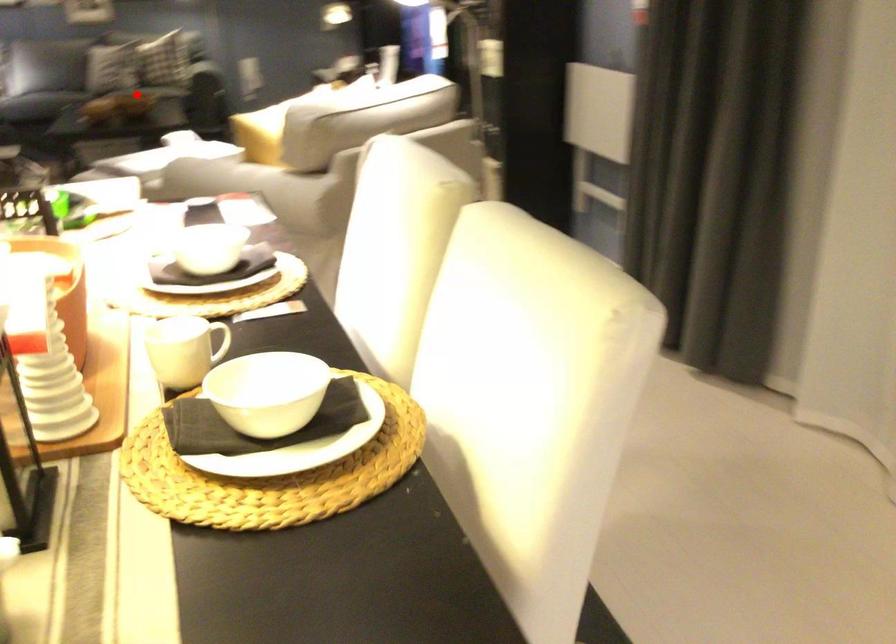
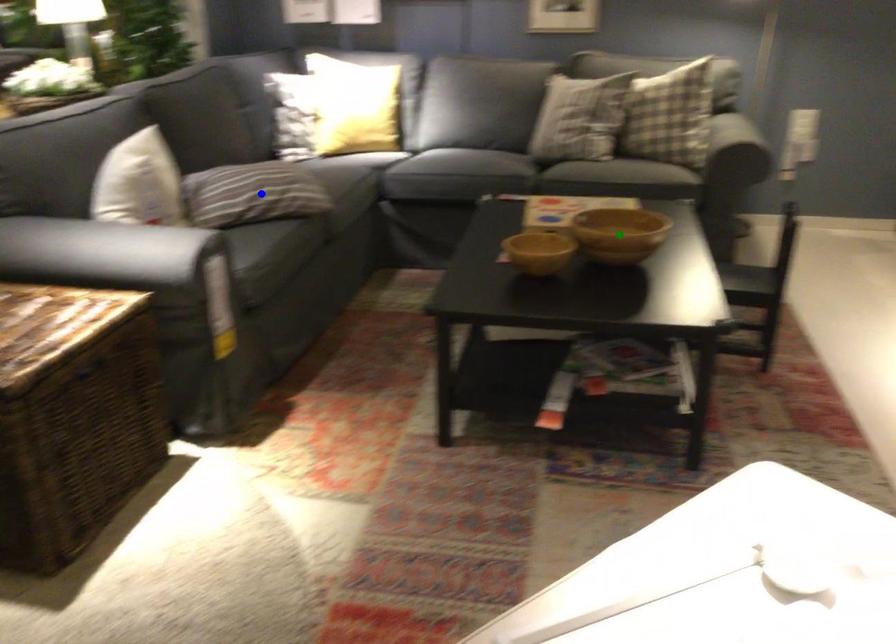
Question: I am providing you with two images of the same scene from different viewpoints. A red point is marked on the first image. You are given multiple points on the second image. Which point in image 2 represents the same 3d spot as the red point in image 1?

Choices:
 (A) yellow point
 (B) green point
 (C) blue point

Answer: (A)